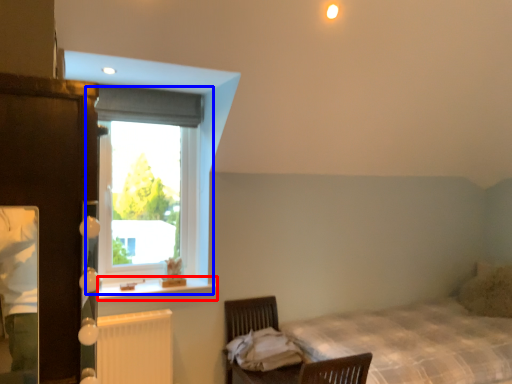
Question: Which point is closer to the camera, window sill (highlighted by a red box) or window (highlighted by a blue box)?

Choices:
 (A) window sill
 (B) window

Answer: (A)